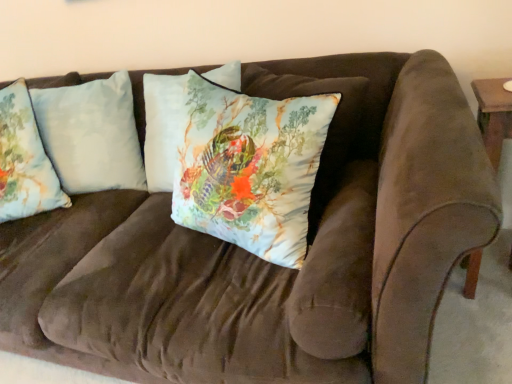
What do you see at coordinates (91, 134) in the screenshot?
I see `light blue fabric pillow at left, which ranks as the second pillow in right-to-left order` at bounding box center [91, 134].

Where is `light blue fabric pillow at left, placed as the third pillow when sorted from right to left`? light blue fabric pillow at left, placed as the third pillow when sorted from right to left is located at coordinates (24, 160).

Is silky floral pillow at center, marked as the third pillow in a left-to-right arrangement, positioned with its back to light blue fabric pillow at left, which ranks as the second pillow in right-to-left order?

silky floral pillow at center, marked as the third pillow in a left-to-right arrangement, does not have its back to light blue fabric pillow at left, which ranks as the second pillow in right-to-left order.

Does point (246, 197) appear closer or farther from the camera than point (106, 132)?

Point (246, 197) appears to be closer to the viewer than point (106, 132).

Considering the positions of objects silky floral pillow at center, positioned as the first pillow in right-to-left order, and light blue fabric pillow at left, which appears as the second pillow when viewed from the left, in the image provided, who is more to the right, silky floral pillow at center, positioned as the first pillow in right-to-left order, or light blue fabric pillow at left, which appears as the second pillow when viewed from the left,?

From the viewer's perspective, silky floral pillow at center, positioned as the first pillow in right-to-left order, appears more on the right side.

Based on the photo, from the image's perspective, which one is positioned lower, silky floral pillow at center, positioned as the first pillow in right-to-left order, or light blue fabric pillow at left, which appears as the second pillow when viewed from the left?

silky floral pillow at center, positioned as the first pillow in right-to-left order.

Which object is wider, light blue fabric pillow at left, which appears as the second pillow when viewed from the left, or silky floral pillow at center, marked as the third pillow in a left-to-right arrangement?

light blue fabric pillow at left, which appears as the second pillow when viewed from the left, is wider.

Which pillow is the 1st one when counting from the left side of the silky floral pillow at center, marked as the third pillow in a left-to-right arrangement? Please provide its 2D coordinates.

[(91, 134)]

Is light blue fabric pillow at left, which ranks as the second pillow in right-to-left order, far away from silky floral pillow at center, positioned as the first pillow in right-to-left order?

No, there isn't a large distance between light blue fabric pillow at left, which ranks as the second pillow in right-to-left order, and silky floral pillow at center, positioned as the first pillow in right-to-left order.

Is light blue fabric pillow at left, which ranks as the second pillow in right-to-left order, situated inside silky floral pillow at center, marked as the third pillow in a left-to-right arrangement, or outside?

light blue fabric pillow at left, which ranks as the second pillow in right-to-left order, cannot be found inside silky floral pillow at center, marked as the third pillow in a left-to-right arrangement.

Is silky floral pillow at center, positioned as the first pillow in right-to-left order, taller than light blue fabric pillow at left, the first pillow from the left?

Indeed, silky floral pillow at center, positioned as the first pillow in right-to-left order, has a greater height compared to light blue fabric pillow at left, the first pillow from the left.

From a real-world perspective, who is located higher, silky floral pillow at center, positioned as the first pillow in right-to-left order, or light blue fabric pillow at left, the first pillow from the left?

light blue fabric pillow at left, the first pillow from the left, is physically above.

Considering the positions of objects silky floral pillow at center, positioned as the first pillow in right-to-left order, and light blue fabric pillow at left, placed as the third pillow when sorted from right to left, in the image provided, who is more to the right, silky floral pillow at center, positioned as the first pillow in right-to-left order, or light blue fabric pillow at left, placed as the third pillow when sorted from right to left,?

From the viewer's perspective, silky floral pillow at center, positioned as the first pillow in right-to-left order, appears more on the right side.

Can you confirm if light blue fabric pillow at left, placed as the third pillow when sorted from right to left, is smaller than light blue fabric pillow at left, which appears as the second pillow when viewed from the left?

Indeed, light blue fabric pillow at left, placed as the third pillow when sorted from right to left, has a smaller size compared to light blue fabric pillow at left, which appears as the second pillow when viewed from the left.

Is the depth of light blue fabric pillow at left, placed as the third pillow when sorted from right to left, less than that of light blue fabric pillow at left, which ranks as the second pillow in right-to-left order?

Yes, light blue fabric pillow at left, placed as the third pillow when sorted from right to left, is closer to the viewer.

In terms of height, does light blue fabric pillow at left, placed as the third pillow when sorted from right to left, look taller or shorter compared to light blue fabric pillow at left, which ranks as the second pillow in right-to-left order?

Considering their sizes, light blue fabric pillow at left, placed as the third pillow when sorted from right to left, has less height than light blue fabric pillow at left, which ranks as the second pillow in right-to-left order.

Considering the positions of points (42, 203) and (102, 83), is point (42, 203) closer to camera compared to point (102, 83)?

Yes, it is.

From the picture: Considering the sizes of objects light blue fabric pillow at left, which ranks as the second pillow in right-to-left order, and light blue fabric pillow at left, the first pillow from the left, in the image provided, who is thinner, light blue fabric pillow at left, which ranks as the second pillow in right-to-left order, or light blue fabric pillow at left, the first pillow from the left,?

With smaller width is light blue fabric pillow at left, the first pillow from the left.

Which is behind, point (98, 121) or point (8, 136)?

The point (98, 121) is farther from the camera.

Could you tell me if light blue fabric pillow at left, which ranks as the second pillow in right-to-left order, is facing light blue fabric pillow at left, placed as the third pillow when sorted from right to left?

Yes, light blue fabric pillow at left, which ranks as the second pillow in right-to-left order, faces towards light blue fabric pillow at left, placed as the third pillow when sorted from right to left.

Which pillow is the 1st one when counting from the front of the light blue fabric pillow at left, which ranks as the second pillow in right-to-left order? Please provide its 2D coordinates.

[(24, 160)]

In the scene shown: Are light blue fabric pillow at left, placed as the third pillow when sorted from right to left, and silky floral pillow at center, marked as the third pillow in a left-to-right arrangement, far apart?

light blue fabric pillow at left, placed as the third pillow when sorted from right to left, is actually quite close to silky floral pillow at center, marked as the third pillow in a left-to-right arrangement.

Is light blue fabric pillow at left, placed as the third pillow when sorted from right to left, facing away from silky floral pillow at center, positioned as the first pillow in right-to-left order?

That's not correct — light blue fabric pillow at left, placed as the third pillow when sorted from right to left, is not looking away from silky floral pillow at center, positioned as the first pillow in right-to-left order.

From a real-world perspective, is light blue fabric pillow at left, the first pillow from the left, located beneath silky floral pillow at center, positioned as the first pillow in right-to-left order?

No, from a real-world perspective, light blue fabric pillow at left, the first pillow from the left, is not beneath silky floral pillow at center, positioned as the first pillow in right-to-left order.

Which object is positioned more to the right, light blue fabric pillow at left, placed as the third pillow when sorted from right to left, or silky floral pillow at center, positioned as the first pillow in right-to-left order?

silky floral pillow at center, positioned as the first pillow in right-to-left order, is more to the right.

Locate an element on the screen. The width and height of the screenshot is (512, 384). the 1st pillow above the light blue fabric pillow at left, which appears as the second pillow when viewed from the left (from a real-world perspective) is located at coordinates (250, 167).

From the image's perspective, which pillow is the 2nd one above the silky floral pillow at center, marked as the third pillow in a left-to-right arrangement? Please provide its 2D coordinates.

[(91, 134)]

Based on the photo, which object lies further to the anchor point light blue fabric pillow at left, the first pillow from the left, silky floral pillow at center, positioned as the first pillow in right-to-left order, or light blue fabric pillow at left, which ranks as the second pillow in right-to-left order?

silky floral pillow at center, positioned as the first pillow in right-to-left order, is further to light blue fabric pillow at left, the first pillow from the left.

From the image, which object appears to be farther from light blue fabric pillow at left, the first pillow from the left, light blue fabric pillow at left, which ranks as the second pillow in right-to-left order, or silky floral pillow at center, marked as the third pillow in a left-to-right arrangement?

silky floral pillow at center, marked as the third pillow in a left-to-right arrangement, is positioned further to the anchor light blue fabric pillow at left, the first pillow from the left.

Considering their positions, is light blue fabric pillow at left, the first pillow from the left, positioned further to light blue fabric pillow at left, which appears as the second pillow when viewed from the left, than silky floral pillow at center, positioned as the first pillow in right-to-left order?

Among the two, silky floral pillow at center, positioned as the first pillow in right-to-left order, is located further to light blue fabric pillow at left, which appears as the second pillow when viewed from the left.

Which object lies further to the anchor point light blue fabric pillow at left, which ranks as the second pillow in right-to-left order, silky floral pillow at center, positioned as the first pillow in right-to-left order, or light blue fabric pillow at left, placed as the third pillow when sorted from right to left?

silky floral pillow at center, positioned as the first pillow in right-to-left order, is positioned further to the anchor light blue fabric pillow at left, which ranks as the second pillow in right-to-left order.

From the image, which object appears to be nearer to silky floral pillow at center, marked as the third pillow in a left-to-right arrangement, light blue fabric pillow at left, which ranks as the second pillow in right-to-left order, or light blue fabric pillow at left, placed as the third pillow when sorted from right to left?

Based on the image, light blue fabric pillow at left, which ranks as the second pillow in right-to-left order, appears to be nearer to silky floral pillow at center, marked as the third pillow in a left-to-right arrangement.

Looking at this image, estimate the real-world distances between objects in this image. Which object is further from silky floral pillow at center, marked as the third pillow in a left-to-right arrangement, light blue fabric pillow at left, placed as the third pillow when sorted from right to left, or light blue fabric pillow at left, which appears as the second pillow when viewed from the left?

light blue fabric pillow at left, placed as the third pillow when sorted from right to left, lies further to silky floral pillow at center, marked as the third pillow in a left-to-right arrangement, than the other object.

Locate an element on the screen. pillow situated between light blue fabric pillow at left, the first pillow from the left, and silky floral pillow at center, positioned as the first pillow in right-to-left order, from left to right is located at coordinates (91, 134).